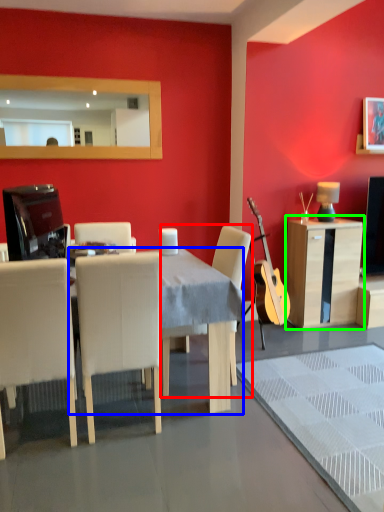
Question: Which object is positioned closest to chair (highlighted by a red box)? Select from desk (highlighted by a blue box) and cabinetry (highlighted by a green box).

Choices:
 (A) desk
 (B) cabinetry

Answer: (A)